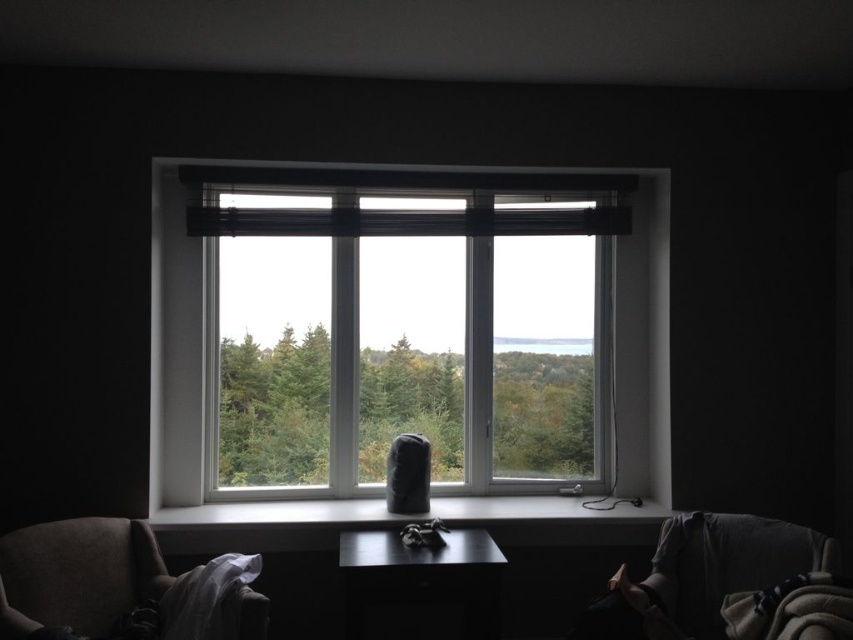
Can you confirm if white plastic window at center is positioned below dark gray fabric armchair at lower left?

Incorrect, white plastic window at center is not positioned below dark gray fabric armchair at lower left.

Between point (288, 320) and point (68, 528), which one is positioned in front?

Point (68, 528)

The width and height of the screenshot is (853, 640). What do you see at coordinates (405, 333) in the screenshot?
I see `white plastic window at center` at bounding box center [405, 333].

You are a GUI agent. You are given a task and a screenshot of the screen. Output one action in this format:
    pyautogui.click(x=<x>, y=<y>)
    Task: Click on the white plastic window at center
    Image resolution: width=853 pixels, height=640 pixels.
    Given the screenshot: What is the action you would take?
    pyautogui.click(x=405, y=333)

Measure the distance from dark gray fabric armchair at lower left to white smooth window sill at center.

A distance of 60.56 centimeters exists between dark gray fabric armchair at lower left and white smooth window sill at center.

Is point (56, 524) positioned in front of point (595, 520)?

Yes, point (56, 524) is in front of point (595, 520).

This screenshot has width=853, height=640. In order to click on dark gray fabric armchair at lower left in this screenshot , I will do `click(76, 573)`.

Who is higher up, white plastic window at center or white smooth window sill at center?

white plastic window at center is above.

Between white plastic window at center and white smooth window sill at center, which one appears on the right side from the viewer's perspective?

white smooth window sill at center is more to the right.

What are the coordinates of `white plastic window at center` in the screenshot? It's located at (405, 333).